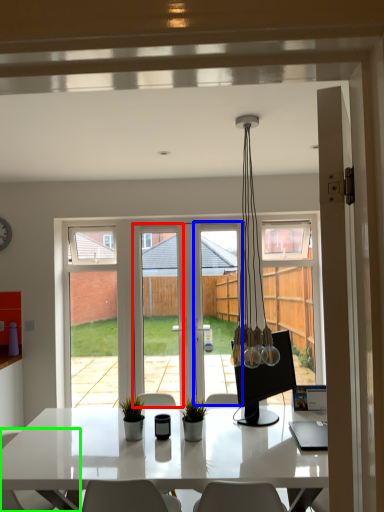
Question: Considering the real-world distances, which object is farthest from screen door (highlighted by a red box)? screen door (highlighted by a blue box) or chair (highlighted by a green box)?

Choices:
 (A) screen door
 (B) chair

Answer: (B)